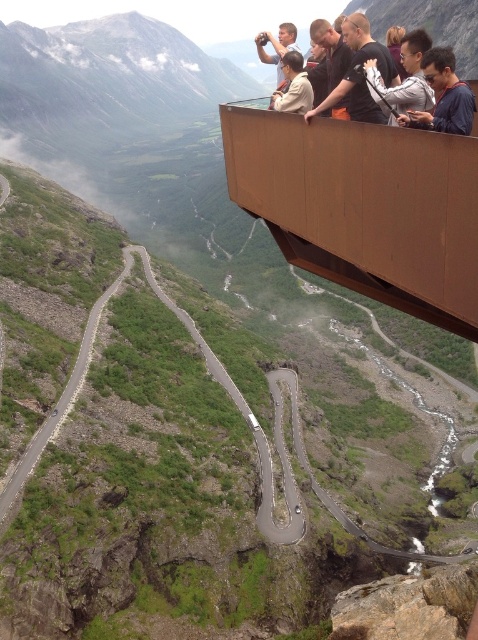
Question: Which object is the farthest from the dark blue shirt at upper right?

Choices:
 (A) light brown jacket at center
 (B) matte black jacket at upper center
 (C) matte black camera at upper center
 (D) brown wood balcony at upper center

Answer: (C)

Question: Which is nearer to the matte black jacket at upper center?

Choices:
 (A) dark blue shirt at upper right
 (B) light brown jacket at center
 (C) dark blue shirt at upper center
 (D) brown wood balcony at upper center

Answer: (B)

Question: Considering the relative positions of brown wood balcony at upper center and dark blue shirt at upper right in the image provided, where is brown wood balcony at upper center located with respect to dark blue shirt at upper right?

Choices:
 (A) above
 (B) below

Answer: (B)

Question: Does dark blue shirt at upper right lie behind matte black camera at upper center?

Choices:
 (A) no
 (B) yes

Answer: (A)

Question: Which is nearer to the matte black camera at upper center?

Choices:
 (A) matte black jacket at upper center
 (B) dark blue shirt at upper center
 (C) light brown jacket at center
 (D) brown wood balcony at upper center

Answer: (D)

Question: Can you confirm if dark blue shirt at upper right is positioned to the right of light brown jacket at center?

Choices:
 (A) yes
 (B) no

Answer: (A)